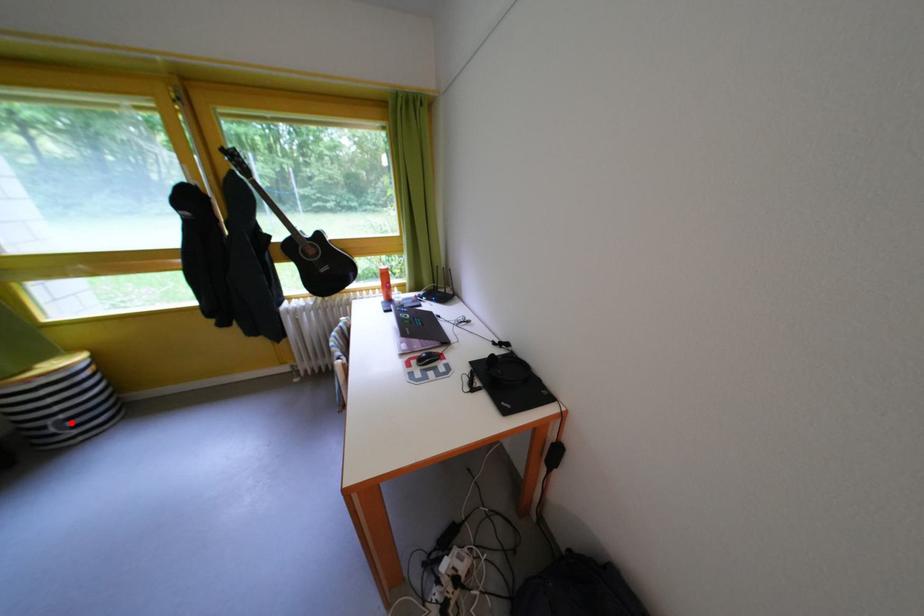
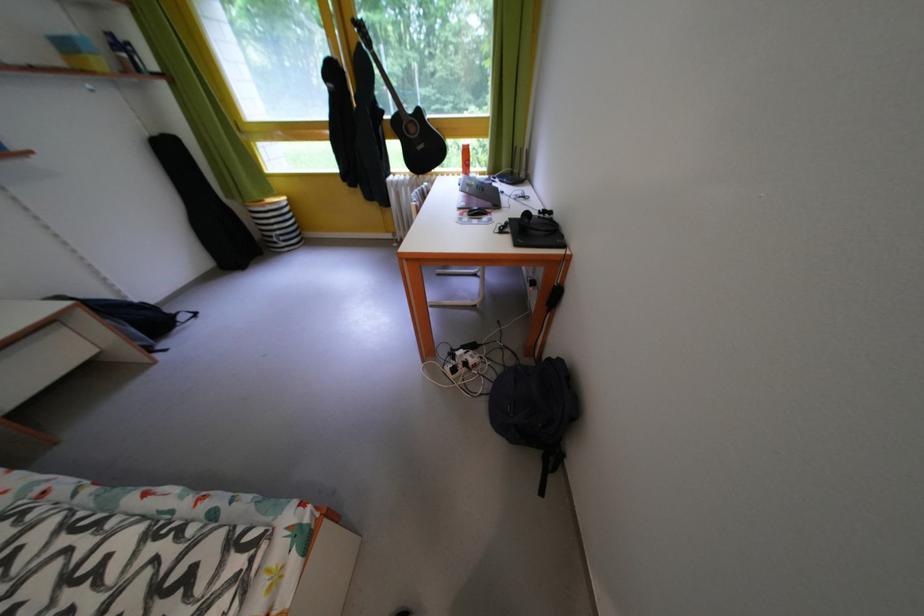
Question: I am providing you with two images of the same scene from different viewpoints. Given a red point in image1, look at the same physical point in image2. Is it:

Choices:
 (A) Closer to the viewpoint
 (B) Farther from the viewpoint

Answer: (B)